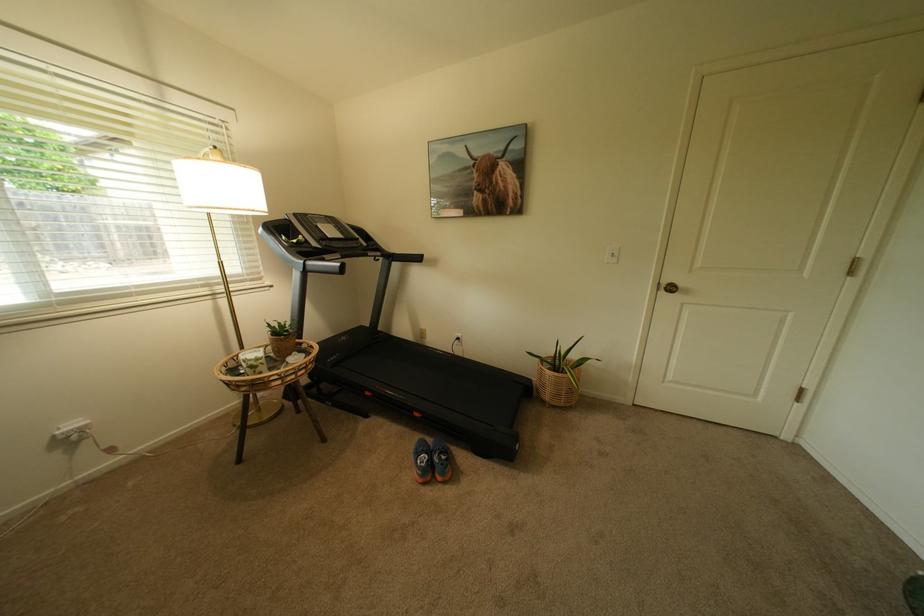
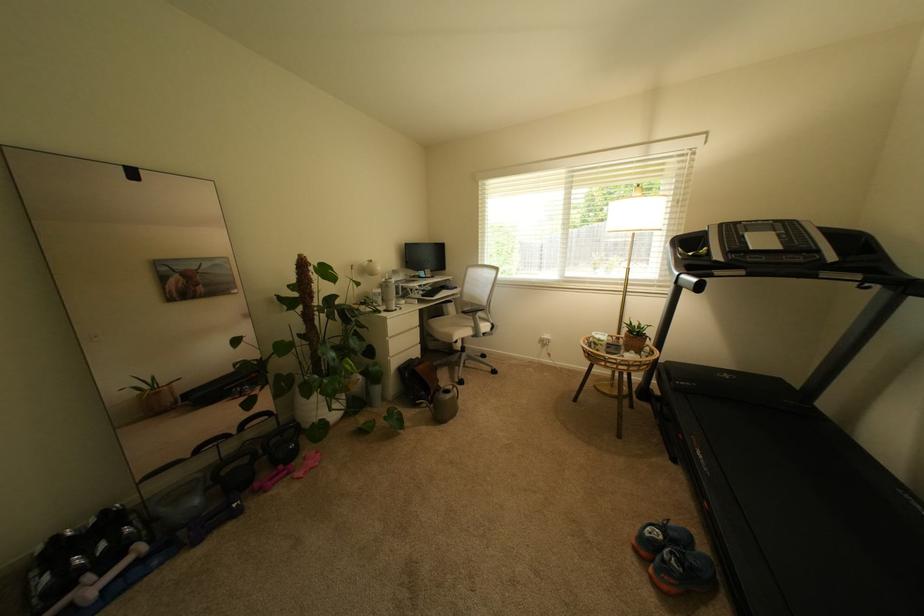
The point at [445,463] is marked in the first image. Where is the corresponding point in the second image?

(674, 557)